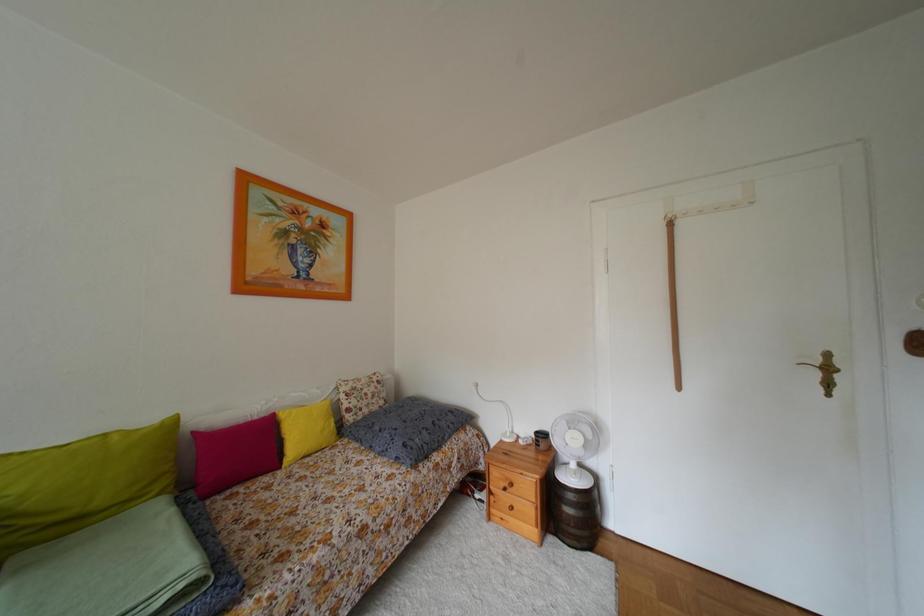
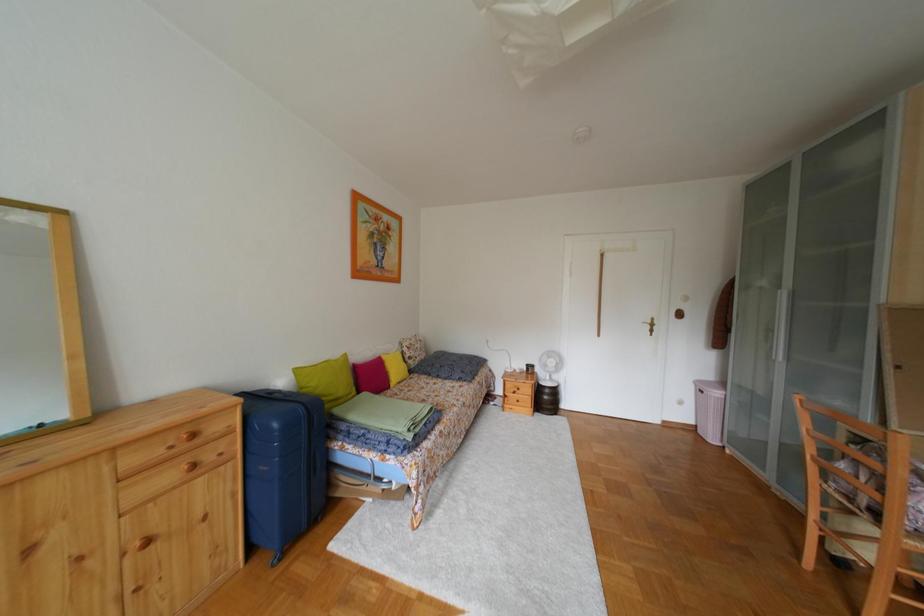
In a continuous first-person perspective shot, in which direction is the camera moving?

The cameraman walked toward left, backward.